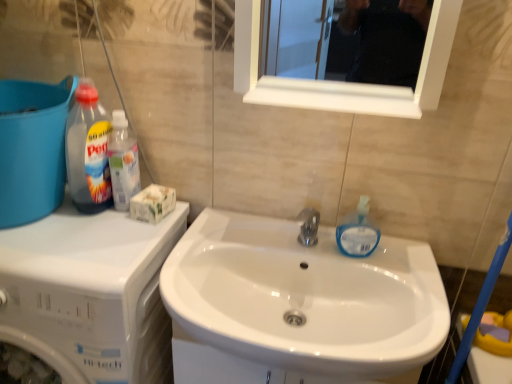
Question: From a real-world perspective, does blue plastic bucket at left sit lower than white glossy dishwasher at left?

Choices:
 (A) no
 (B) yes

Answer: (A)

Question: Can you confirm if blue plastic bucket at left is positioned to the left of white glossy dishwasher at left?

Choices:
 (A) yes
 (B) no

Answer: (A)

Question: Is blue plastic bucket at left bigger than white glossy dishwasher at left?

Choices:
 (A) yes
 (B) no

Answer: (B)

Question: Is blue plastic bucket at left thinner than white glossy dishwasher at left?

Choices:
 (A) no
 (B) yes

Answer: (B)

Question: Is blue plastic bucket at left facing towards white glossy dishwasher at left?

Choices:
 (A) yes
 (B) no

Answer: (B)

Question: From the image's perspective, is blue plastic bucket at left on top of white glossy dishwasher at left?

Choices:
 (A) no
 (B) yes

Answer: (B)

Question: Could you tell me if translucent plastic bottle at upper left, the second cleaning product from the left, is facing white glossy dishwasher at left?

Choices:
 (A) yes
 (B) no

Answer: (B)

Question: Is translucent plastic bottle at upper left, the second cleaning product positioned from the right, located outside white glossy dishwasher at left?

Choices:
 (A) yes
 (B) no

Answer: (A)

Question: Does translucent plastic bottle at upper left, the second cleaning product positioned from the right, appear on the left side of white glossy dishwasher at left?

Choices:
 (A) yes
 (B) no

Answer: (B)

Question: Is translucent plastic bottle at upper left, the second cleaning product from the left, far from white glossy dishwasher at left?

Choices:
 (A) yes
 (B) no

Answer: (B)

Question: Can you confirm if translucent plastic bottle at upper left, the second cleaning product from the left, is thinner than white glossy dishwasher at left?

Choices:
 (A) yes
 (B) no

Answer: (A)

Question: From the image's perspective, is translucent plastic bottle at upper left, the second cleaning product positioned from the right, located above white glossy dishwasher at left?

Choices:
 (A) no
 (B) yes

Answer: (B)

Question: Considering the relative sizes of translucent blue liquid soap at sink right, the 1th cleaning product positioned from the right, and blue plastic bucket at left in the image provided, is translucent blue liquid soap at sink right, the 1th cleaning product positioned from the right, wider than blue plastic bucket at left?

Choices:
 (A) yes
 (B) no

Answer: (B)